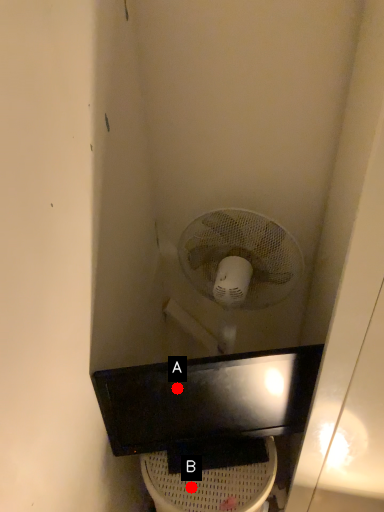
Question: Two points are circled on the image, labeled by A and B beside each circle. Which point is farther to the camera?

Choices:
 (A) A is further
 (B) B is further

Answer: (B)